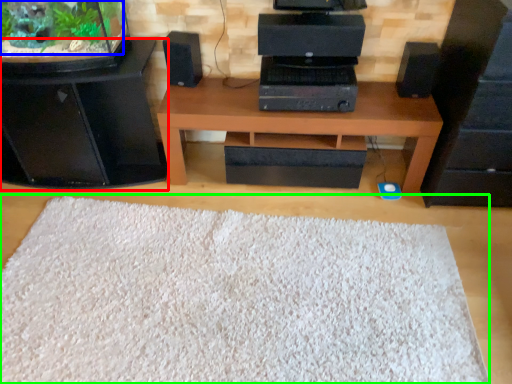
Question: Which is farther away from furniture (highlighted by a red box)? plant (highlighted by a blue box) or mat (highlighted by a green box)?

Choices:
 (A) plant
 (B) mat

Answer: (B)